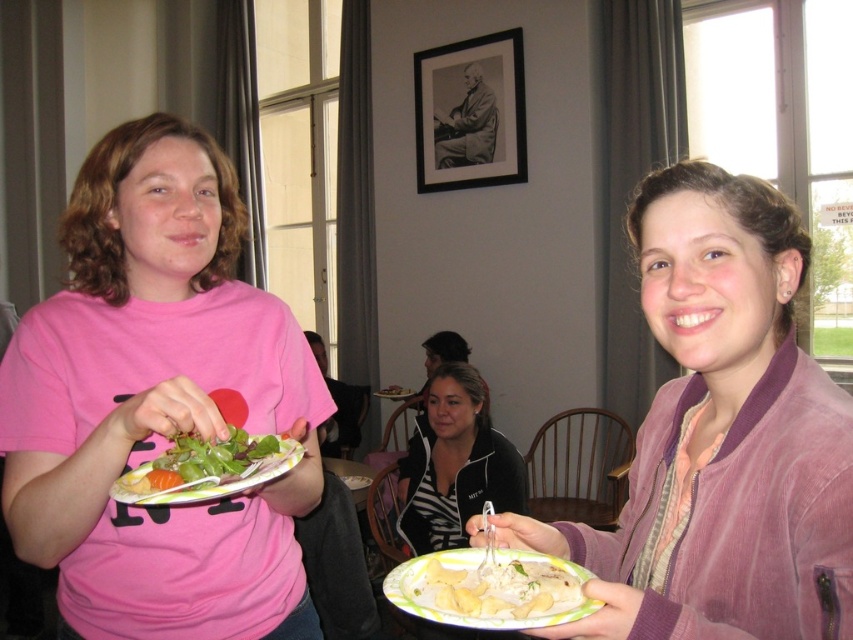
You are setting up a picnic and need to choose between the white paper plate at lower center and the matte plastic plate at center. Which plate has a larger surface area to fit more food?

The white paper plate at lower center might be wider than matte plastic plate at center, so it could have a larger surface area to accommodate more food.